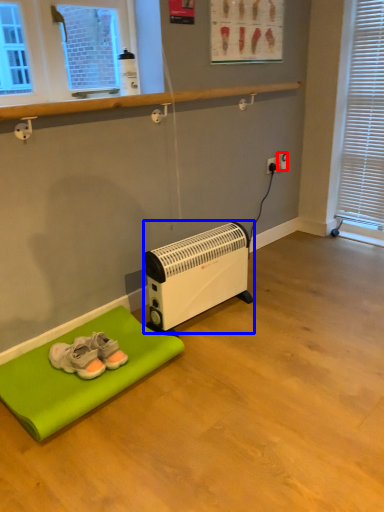
Question: Which object appears farthest to the camera in this image, electric outlet (highlighted by a red box) or heater (highlighted by a blue box)?

Choices:
 (A) electric outlet
 (B) heater

Answer: (A)